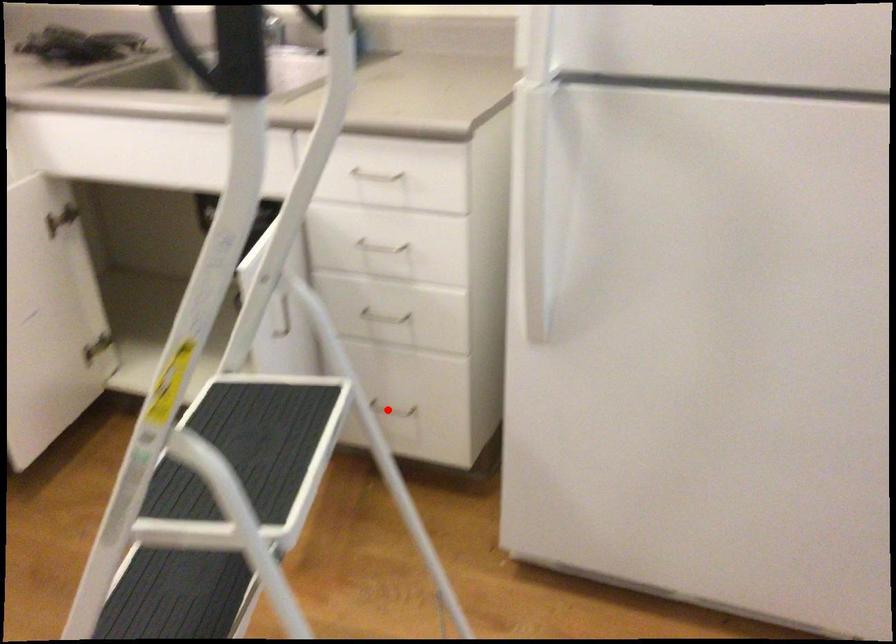
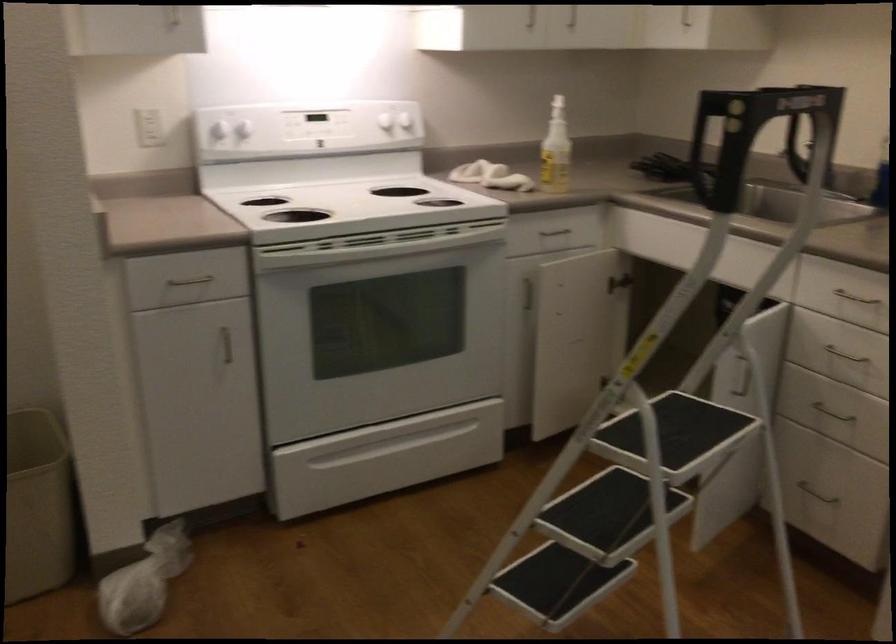
Question: A red point is marked in image1. In image2, is the corresponding 3D point closer to the camera or farther? Reply with the corresponding letter.

Choices:
 (A) The corresponding 3D point is closer.
 (B) The corresponding 3D point is farther.

Answer: (B)